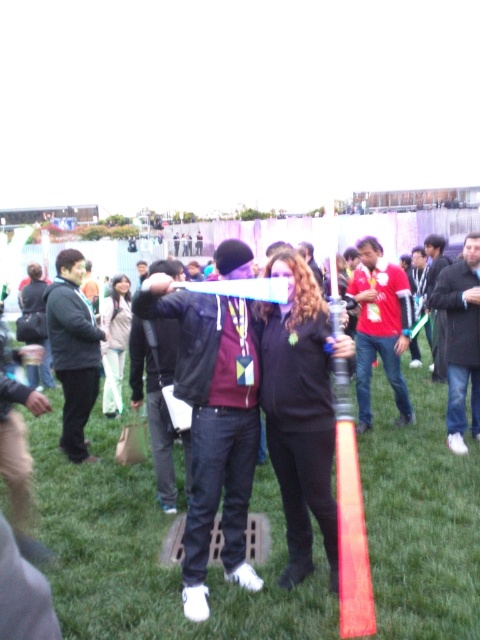
Question: Is green grass at center to the left of light beige fabric jacket at center from the viewer's perspective?

Choices:
 (A) no
 (B) yes

Answer: (A)

Question: Where is green grass at center located in relation to light beige fabric jacket at center in the image?

Choices:
 (A) right
 (B) left

Answer: (A)

Question: Does green grass at center appear under light beige fabric jacket at center?

Choices:
 (A) yes
 (B) no

Answer: (A)

Question: Which point is farther to the camera?

Choices:
 (A) light beige fabric jacket at center
 (B) green grass at center

Answer: (A)